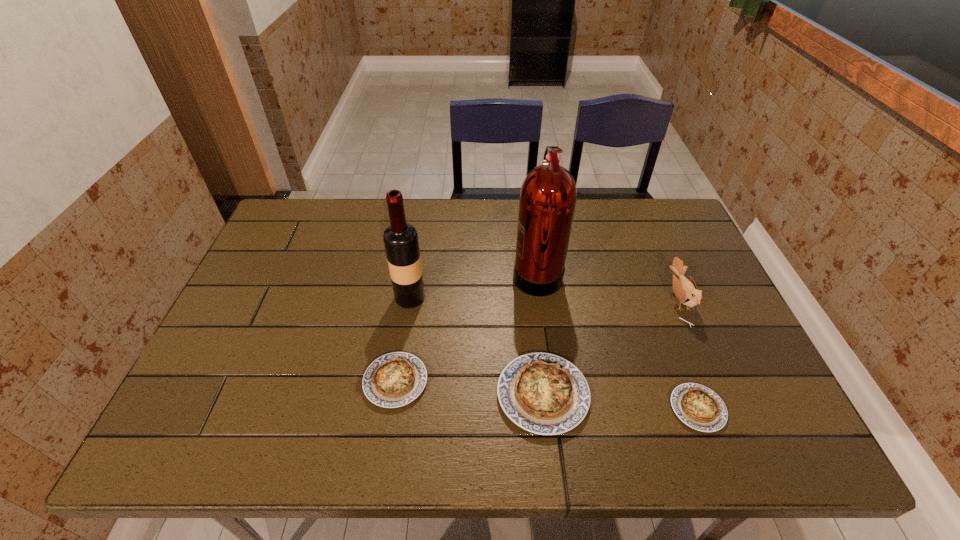
This screenshot has width=960, height=540. What are the coordinates of `bird at the right edge` in the screenshot? It's located at (686, 291).

Locate an element on the screen. The width and height of the screenshot is (960, 540). object positioned at the near right corner is located at coordinates (699, 407).

This screenshot has height=540, width=960. Find the location of `free space at the far edge of the desktop`. free space at the far edge of the desktop is located at coordinates (475, 221).

Identify the location of free spot at the left edge of the desktop. (260, 254).

This screenshot has width=960, height=540. In order to click on vacant space at the right edge of the desktop in this screenshot , I will do `click(667, 298)`.

At what (x,y) coordinates should I click in order to perform the action: click on blank space at the far left corner. Please return your answer as a coordinate pair (x, y). This screenshot has width=960, height=540. Looking at the image, I should click on (310, 221).

Locate an element on the screen. The width and height of the screenshot is (960, 540). vacant position at the far right corner of the desktop is located at coordinates (x=653, y=241).

What are the coordinates of `vacant region between the second shortest quiche and the fifth shortest object` in the screenshot? It's located at (403, 339).

I want to click on free point between the tallest object and the rightmost quiche, so click(617, 340).

Locate an element on the screen. vacant region between the wine bottle and the leftmost quiche is located at coordinates (403, 339).